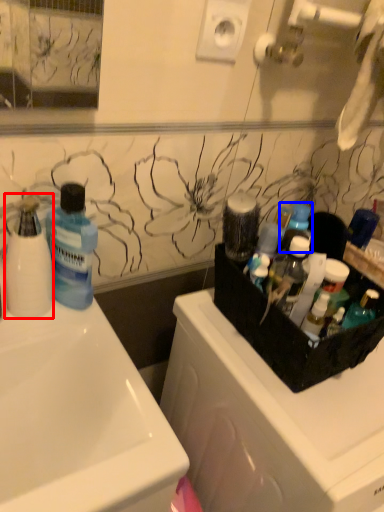
Question: Which object is further to the camera taking this photo, cleaning product (highlighted by a red box) or toiletry (highlighted by a blue box)?

Choices:
 (A) cleaning product
 (B) toiletry

Answer: (B)